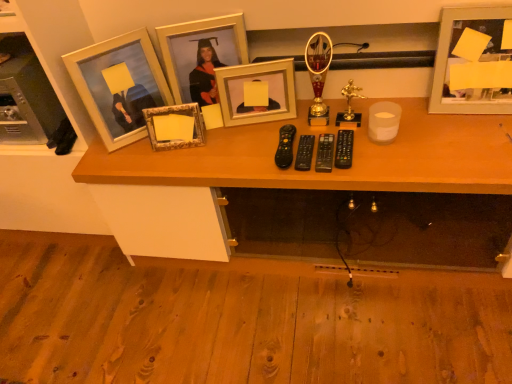
This screenshot has width=512, height=384. Find the location of `vacant space to the right of gold textured photo frame at center, which is the fourth picture frame in right-to-left order`. vacant space to the right of gold textured photo frame at center, which is the fourth picture frame in right-to-left order is located at coordinates (231, 141).